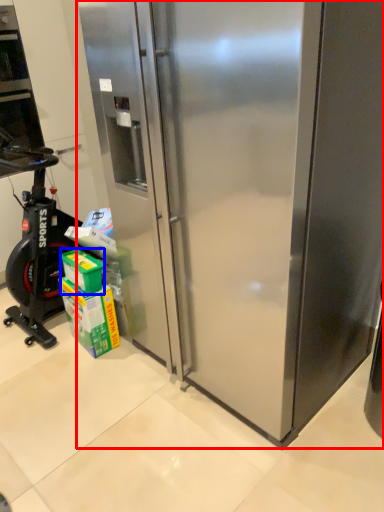
Question: Which object is closer to the camera taking this photo, refrigerator (highlighted by a red box) or box (highlighted by a blue box)?

Choices:
 (A) refrigerator
 (B) box

Answer: (A)